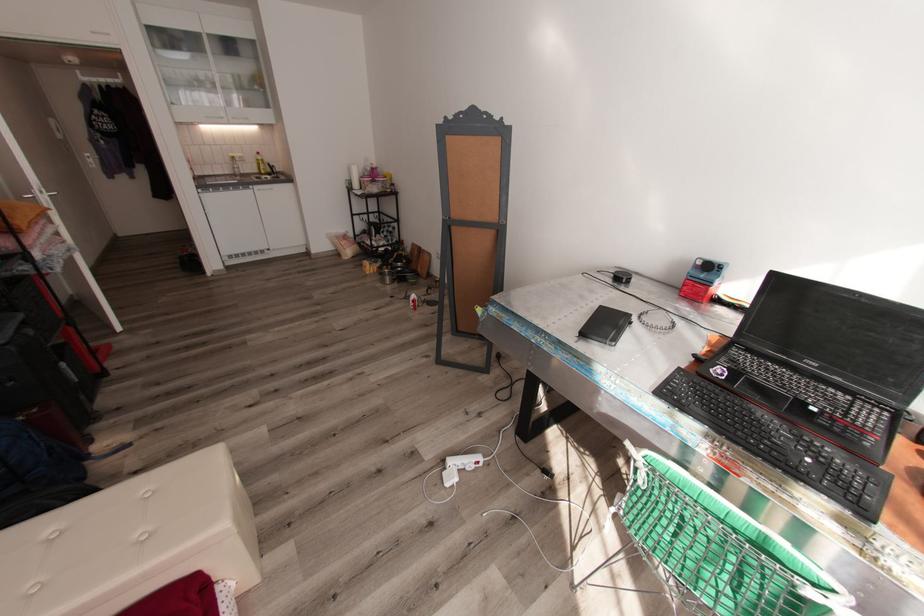
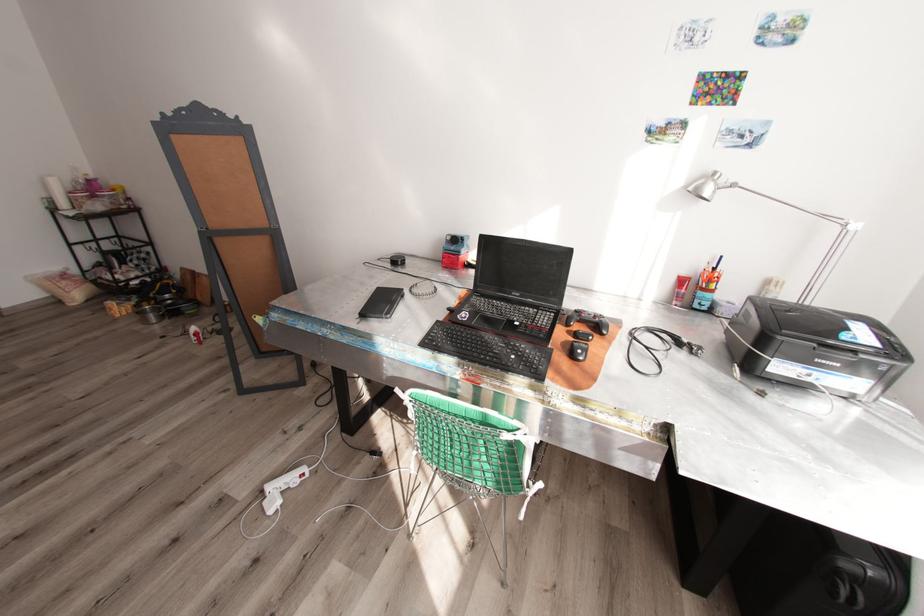
The point at (821,363) is marked in the first image. Where is the corresponding point in the second image?

(523, 294)